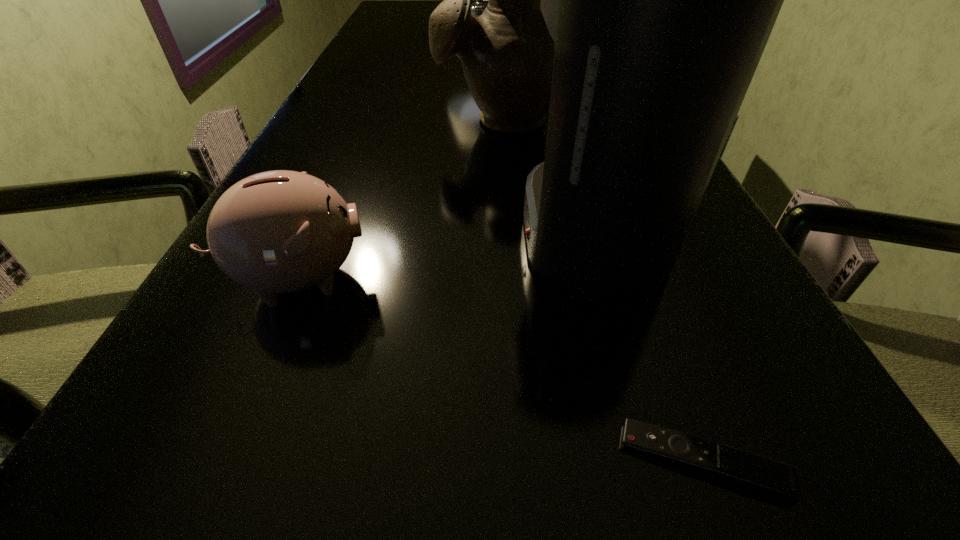
You are a GUI agent. You are given a task and a screenshot of the screen. Output one action in this format:
    pyautogui.click(x=<x>, y=<y>)
    Task: Click on the object that is at the near right corner
    Image resolution: width=960 pixels, height=540 pixels.
    Given the screenshot: What is the action you would take?
    pyautogui.click(x=759, y=473)

Image resolution: width=960 pixels, height=540 pixels. In the image, there is a desktop. Identify the location of vacant space at the near edge. (684, 519).

The image size is (960, 540). Find the location of `vacant area at the left edge of the desktop`. vacant area at the left edge of the desktop is located at coordinates (416, 23).

Locate an element on the screen. Image resolution: width=960 pixels, height=540 pixels. free region at the right edge of the desktop is located at coordinates (714, 415).

The width and height of the screenshot is (960, 540). In the image, there is a desktop. What are the coordinates of `vacant space at the far left corner` in the screenshot? It's located at (420, 9).

Identify the location of unoccupied position between the piggy bank and the tallest object. This screenshot has height=540, width=960. 388,150.

Select which object appears as the fourth closest to the second farthest object. Please provide its 2D coordinates. Your answer should be formatted as a tuple, i.e. [(x, y)], where the tuple contains the x and y coordinates of a point satisfying the conditions above.

[(759, 473)]

Identify which object is the third nearest to the nearest object. Please provide its 2D coordinates. Your answer should be formatted as a tuple, i.e. [(x, y)], where the tuple contains the x and y coordinates of a point satisfying the conditions above.

[(507, 53)]

Identify the location of vacant region that satisfies the following two spatial constraints: 1. at the spout of the nearest object; 2. on the left side of the pitcher. The image size is (960, 540). (532, 461).